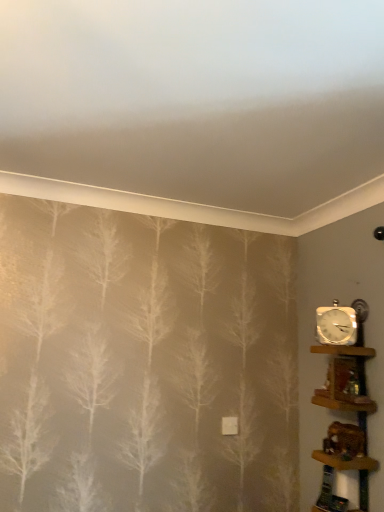
Question: In terms of height, does wooden shelf at right, marked as the second shelf in a top-to-bottom arrangement, look taller or shorter compared to white metallic clock at right?

Choices:
 (A) short
 (B) tall

Answer: (B)

Question: Do you think wooden shelf at right, marked as the second shelf in a top-to-bottom arrangement, is within white metallic clock at right, or outside of it?

Choices:
 (A) outside
 (B) inside

Answer: (A)

Question: Estimate the real-world distances between objects in this image. Which object is farther from the white metallic clock at right?

Choices:
 (A) wooden shelf at right, the 1th shelf in the top-to-bottom sequence
 (B) wooden shelf at right, acting as the 1th shelf starting from the bottom

Answer: (B)

Question: Based on their relative distances, which object is farther from the white metallic clock at right?

Choices:
 (A) wooden shelf at right, the 1th shelf in the top-to-bottom sequence
 (B) wooden shelf at right, acting as the 1th shelf starting from the bottom

Answer: (B)